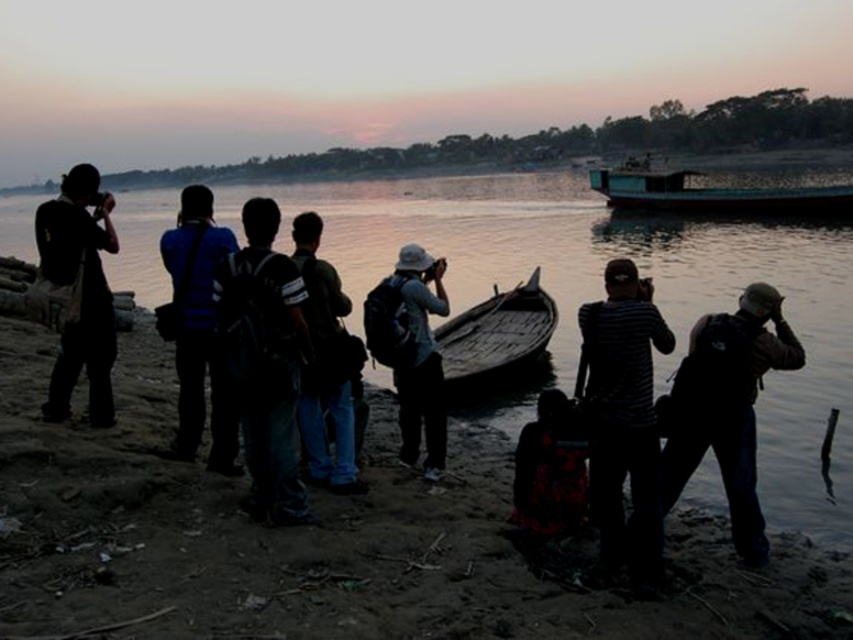
You are a photographer standing at the point marked as point (332, 541) in the image. You want to capture the sunset reflection on the water. Which direction should you face to get the best view of the water and the sunset?

You should face towards the water because the point (332, 541) is on the brown dirt shoreline at lower left, so facing away from the shoreline towards the water would allow you to capture the sunset reflection on the water.

You are a photographer standing on the riverside and see the blue fabric backpack at center and the wooden canoe at center. Which object is located to the right of the other?

The wooden canoe at center is to the right of the blue fabric backpack at center because the blue fabric backpack at center is positioned on the left side of wooden canoe at center.